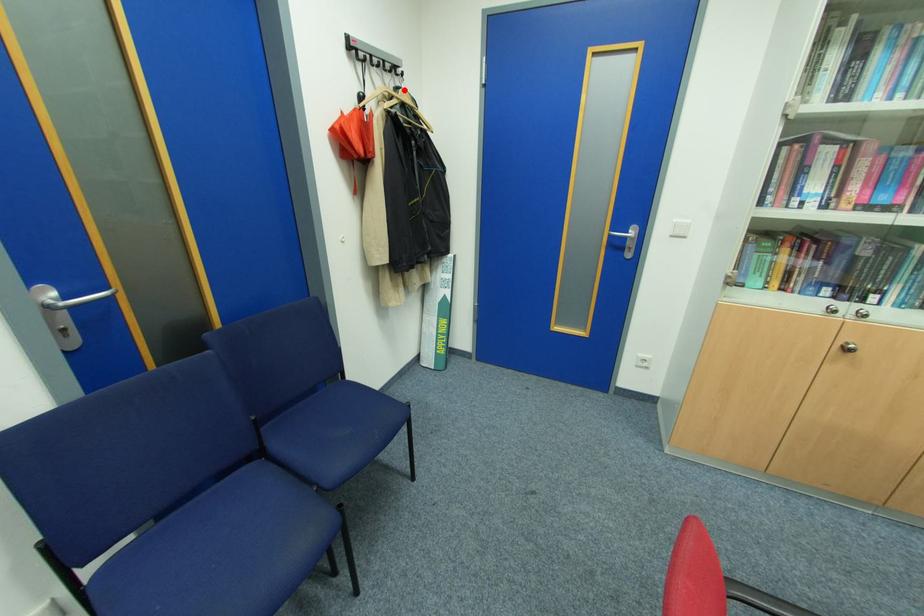
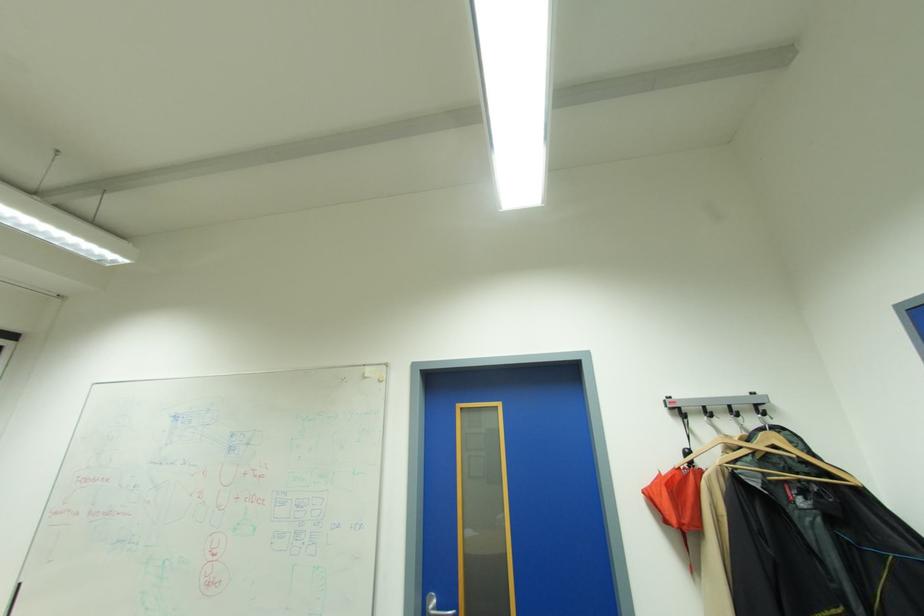
Where in the second image is the point corresponding to the highlighted location from the first image?

(764, 434)